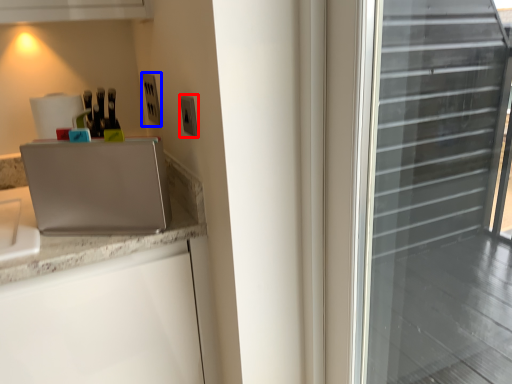
Question: Which of the following is the farthest to the observer, electric outlet (highlighted by a red box) or electric outlet (highlighted by a blue box)?

Choices:
 (A) electric outlet
 (B) electric outlet

Answer: (B)